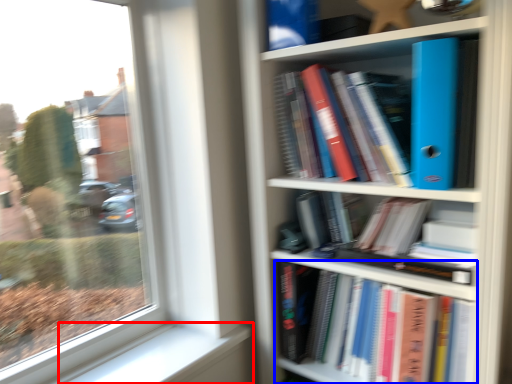
Question: Among these objects, which one is nearest to the camera, window sill (highlighted by a red box) or book (highlighted by a blue box)?

Choices:
 (A) window sill
 (B) book

Answer: (B)